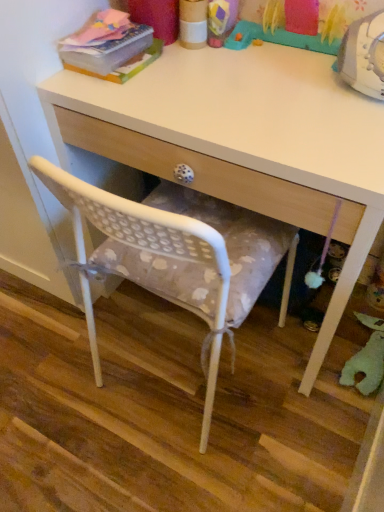
Question: Does green felt toy at lower right, the 1th toy when ordered from bottom to top, appear on the left side of plastic toy at upper center, the 1th toy viewed from the left?

Choices:
 (A) no
 (B) yes

Answer: (A)

Question: Can you confirm if green felt toy at lower right, which is the 2th toy in left-to-right order, is bigger than plastic toy at upper center, which appears as the second toy when ordered from the bottom?

Choices:
 (A) yes
 (B) no

Answer: (B)

Question: Is green felt toy at lower right, marked as the first toy in a right-to-left arrangement, far from plastic toy at upper center, the first toy viewed from the top?

Choices:
 (A) yes
 (B) no

Answer: (B)

Question: Is plastic toy at upper center, the first toy viewed from the top, at the back of green felt toy at lower right, marked as the 1th toy in a back-to-front arrangement?

Choices:
 (A) yes
 (B) no

Answer: (B)

Question: Is green felt toy at lower right, placed as the 2th toy when sorted from top to bottom, not within plastic toy at upper center, the second toy from the right?

Choices:
 (A) yes
 (B) no

Answer: (A)

Question: In terms of height, does white wood desk at center look taller or shorter compared to green felt toy at lower right, placed as the 2th toy when sorted from top to bottom?

Choices:
 (A) tall
 (B) short

Answer: (A)

Question: In terms of size, does white wood desk at center appear bigger or smaller than green felt toy at lower right, marked as the first toy in a right-to-left arrangement?

Choices:
 (A) small
 (B) big

Answer: (B)

Question: Relative to green felt toy at lower right, which is the 2th toy in left-to-right order, is white wood desk at center in front or behind?

Choices:
 (A) front
 (B) behind

Answer: (A)

Question: From a real-world perspective, is white wood desk at center positioned above or below green felt toy at lower right, which is the 2th toy in left-to-right order?

Choices:
 (A) below
 (B) above

Answer: (B)

Question: From the image's perspective, is white fabric cushion at center positioned above or below plastic toy at upper center, which appears as the second toy when ordered from the bottom?

Choices:
 (A) below
 (B) above

Answer: (A)

Question: From their relative heights in the image, would you say white fabric cushion at center is taller or shorter than plastic toy at upper center, the first toy viewed from the top?

Choices:
 (A) short
 (B) tall

Answer: (A)

Question: Relative to plastic toy at upper center, which is counted as the first toy, starting from the front, is white fabric cushion at center in front or behind?

Choices:
 (A) behind
 (B) front

Answer: (B)

Question: From a real-world perspective, relative to plastic toy at upper center, the second toy from the right, is white fabric cushion at center vertically above or below?

Choices:
 (A) above
 (B) below

Answer: (B)

Question: Is matte pink book at upper left taller or shorter than white fabric cushion at center?

Choices:
 (A) short
 (B) tall

Answer: (B)

Question: Relative to white fabric cushion at center, is matte pink book at upper left in front or behind?

Choices:
 (A) front
 (B) behind

Answer: (B)